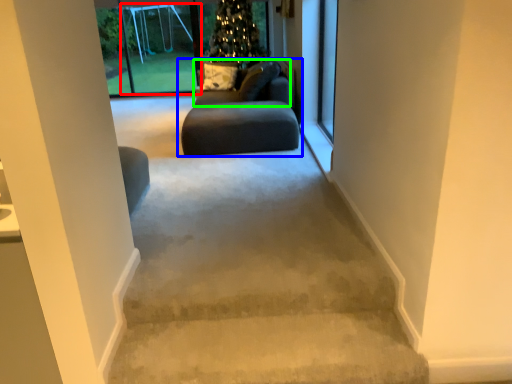
Question: Which object is positioned farthest from screen door (highlighted by a red box)? Select from studio couch (highlighted by a blue box) and couch (highlighted by a green box).

Choices:
 (A) studio couch
 (B) couch

Answer: (A)